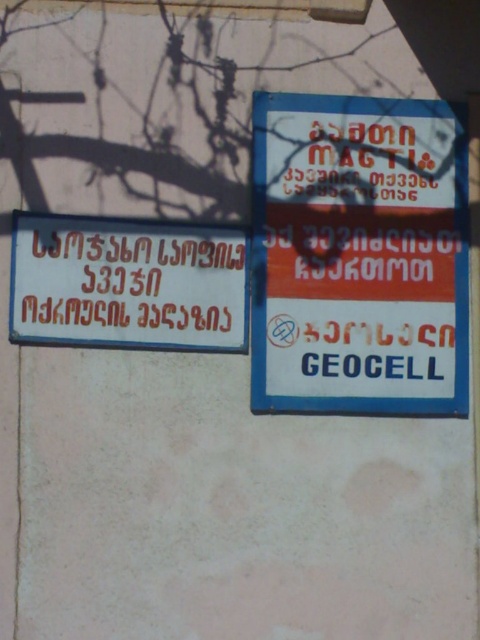
Does blue plastic sign at upper right appear on the left side of matte red sign at center?

Incorrect, blue plastic sign at upper right is not on the left side of matte red sign at center.

Is blue plastic sign at upper right shorter than matte red sign at center?

In fact, blue plastic sign at upper right may be taller than matte red sign at center.

Does point (350, 307) come farther from viewer compared to point (120, 275)?

Yes, point (350, 307) is farther from viewer.

Identify the location of blue plastic sign at upper right. (360, 256).